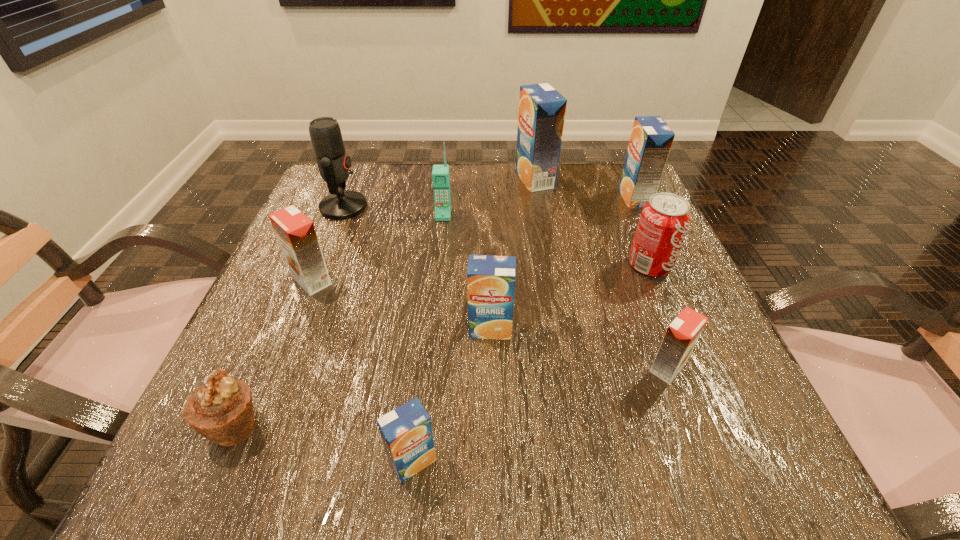
Find the location of a particular element. the seventh farthest object is located at coordinates (490, 279).

Identify the location of muffin. (221, 410).

Find the location of `the right orange orange juice`. the right orange orange juice is located at coordinates (682, 334).

Locate an element on the screen. The width and height of the screenshot is (960, 540). the second orange_juice from right to left is located at coordinates (682, 334).

Image resolution: width=960 pixels, height=540 pixels. I want to click on the second orange_juice from left to right, so click(406, 431).

Where is `the smallest blue orange_juice`? This screenshot has width=960, height=540. the smallest blue orange_juice is located at coordinates (406, 431).

Where is `vacant area situated on the right of the biggest blue orange_juice`? The image size is (960, 540). vacant area situated on the right of the biggest blue orange_juice is located at coordinates (593, 179).

You are a GUI agent. You are given a task and a screenshot of the screen. Output one action in this format:
    pyautogui.click(x=<x>, y=<y>)
    Task: Click on the vacant point located 0.110m on the side of the red microphone with the red ring
    The image size is (960, 540).
    Given the screenshot: What is the action you would take?
    pyautogui.click(x=414, y=207)

The width and height of the screenshot is (960, 540). Identify the location of free space located 0.170m on the front of the rightmost orange_juice. (662, 256).

The width and height of the screenshot is (960, 540). Identify the location of vacant space located on the keypad of the cellular telephone. (436, 284).